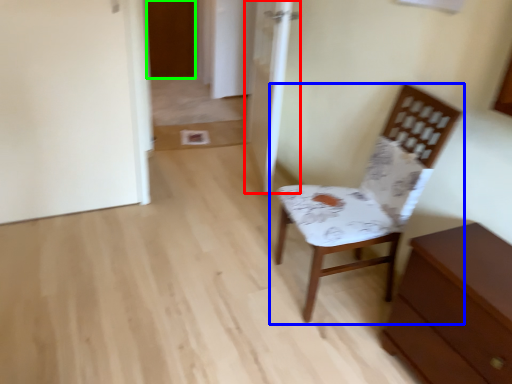
Question: Based on their relative distances, which object is farther from door (highlighted by a red box)? Choose from chair (highlighted by a blue box) and door (highlighted by a green box).

Choices:
 (A) chair
 (B) door

Answer: (B)